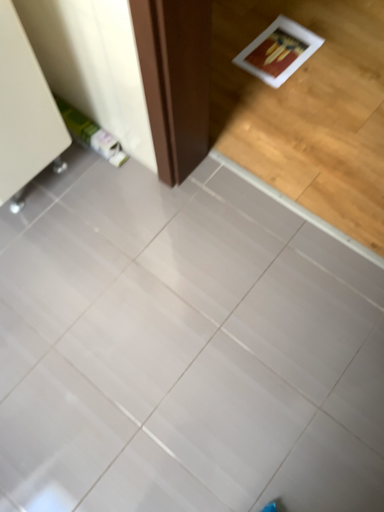
What is the approximate width of white glossy tile at center?

1.14 meters.

What do you see at coordinates (183, 349) in the screenshot?
I see `white glossy tile at center` at bounding box center [183, 349].

Identify the location of white glossy tile at center. This screenshot has height=512, width=384. (183, 349).

Describe the element at coordinates (25, 113) in the screenshot. Image resolution: width=384 pixels, height=512 pixels. I see `white glossy cabinet at upper left` at that location.

The image size is (384, 512). What are the coordinates of `white glossy cabinet at upper left` in the screenshot? It's located at (25, 113).

Identify the location of white glossy tile at center. The width and height of the screenshot is (384, 512). (183, 349).

Is white glossy cabinet at upper left to the left or to the right of white glossy tile at center in the image?

white glossy cabinet at upper left is to the left of white glossy tile at center.

Relative to white glossy tile at center, is white glossy cabinet at upper left in front or behind?

In the image, white glossy cabinet at upper left appears behind white glossy tile at center.

Considering the positions of point (65, 142) and point (112, 344), is point (65, 142) closer or farther from the camera than point (112, 344)?

Point (65, 142) is farther from the camera than point (112, 344).

From the image's perspective, is white glossy cabinet at upper left over white glossy tile at center?

Yes.

From a real-world perspective, is white glossy cabinet at upper left below white glossy tile at center?

Incorrect, from a real-world perspective, white glossy cabinet at upper left is higher than white glossy tile at center.

Considering the sizes of objects white glossy cabinet at upper left and white glossy tile at center in the image provided, who is thinner, white glossy cabinet at upper left or white glossy tile at center?

Thinner between the two is white glossy cabinet at upper left.

Who is shorter, white glossy cabinet at upper left or white glossy tile at center?

white glossy tile at center is shorter.

Does white glossy cabinet at upper left have a larger size compared to white glossy tile at center?

Actually, white glossy cabinet at upper left might be smaller than white glossy tile at center.

Which is correct: white glossy cabinet at upper left is inside white glossy tile at center, or outside of it?

white glossy cabinet at upper left is located beyond the bounds of white glossy tile at center.

Is white glossy cabinet at upper left next to white glossy tile at center?

white glossy cabinet at upper left is not next to white glossy tile at center, and they're not touching.

Based on the photo, is white glossy cabinet at upper left facing away from white glossy tile at center?

No, white glossy tile at center is not at the back of white glossy cabinet at upper left.

What's the angular difference between white glossy cabinet at upper left and white glossy tile at center's facing directions?

The facing directions of white glossy cabinet at upper left and white glossy tile at center are 90.4 degrees apart.

Measure the distance between white glossy cabinet at upper left and white glossy tile at center.

22.22 inches.

You are a GUI agent. You are given a task and a screenshot of the screen. Output one action in this format:
    pyautogui.click(x=<x>, y=<y>)
    Task: Click on the ceramic tile on the right of white glossy cabinet at upper left
    Image resolution: width=384 pixels, height=512 pixels.
    Given the screenshot: What is the action you would take?
    pyautogui.click(x=183, y=349)

Which object is positioned more to the left, white glossy tile at center or white glossy cabinet at upper left?

Positioned to the left is white glossy cabinet at upper left.

Considering the relative positions of white glossy tile at center and white glossy cabinet at upper left in the image provided, is white glossy tile at center behind white glossy cabinet at upper left?

No, the depth of white glossy tile at center is less than that of white glossy cabinet at upper left.

Which is farther, (35, 293) or (24, 185)?

The point (24, 185) is behind.

Consider the image. From the image's perspective, which one is positioned lower, white glossy tile at center or white glossy cabinet at upper left?

From the image's view, white glossy tile at center is below.

From a real-world perspective, is white glossy tile at center positioned over white glossy cabinet at upper left based on gravity?

No, from a real-world perspective, white glossy tile at center is not on top of white glossy cabinet at upper left.

Which of these two, white glossy tile at center or white glossy cabinet at upper left, is wider?

white glossy tile at center is wider.

Considering the relative sizes of white glossy tile at center and white glossy cabinet at upper left in the image provided, is white glossy tile at center taller than white glossy cabinet at upper left?

Incorrect, the height of white glossy tile at center is not larger of that of white glossy cabinet at upper left.

Looking at the image, does white glossy tile at center seem bigger or smaller compared to white glossy cabinet at upper left?

Clearly, white glossy tile at center is larger in size than white glossy cabinet at upper left.

Is white glossy tile at center not within white glossy cabinet at upper left?

white glossy tile at center lies outside white glossy cabinet at upper left's area.

Are white glossy tile at center and white glossy cabinet at upper left making contact?

No, white glossy tile at center is not with white glossy cabinet at upper left.

Could you tell me if white glossy tile at center is facing white glossy cabinet at upper left?

No, white glossy tile at center is not oriented towards white glossy cabinet at upper left.

What are the coordinates of `ceramic tile in front of the white glossy cabinet at upper left` in the screenshot? It's located at (183, 349).

This screenshot has height=512, width=384. I want to click on furniture above the white glossy tile at center (from a real-world perspective), so click(x=25, y=113).

Identify the location of furniture behind the white glossy tile at center. point(25,113).